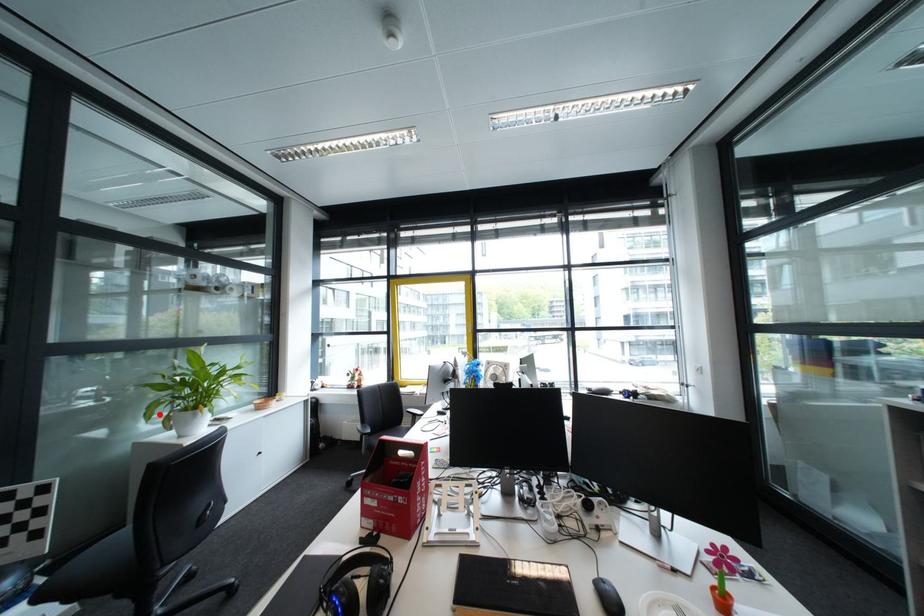
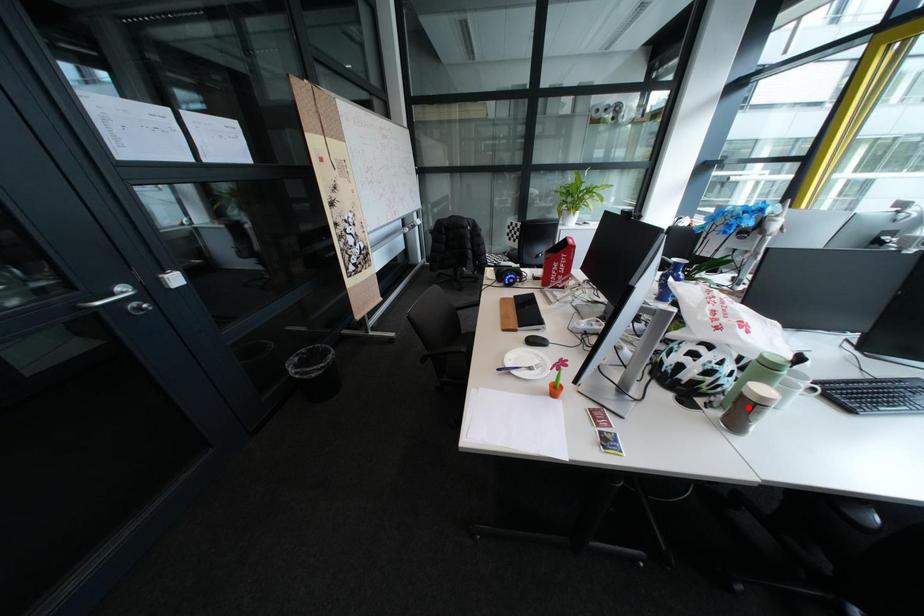
In the scene shown: I am providing you with two images of the same scene from different viewpoints. A red point is marked on the first image and another point is marked on the second image. Is the marked point in image1 the same physical position as the marked point in image2?

No